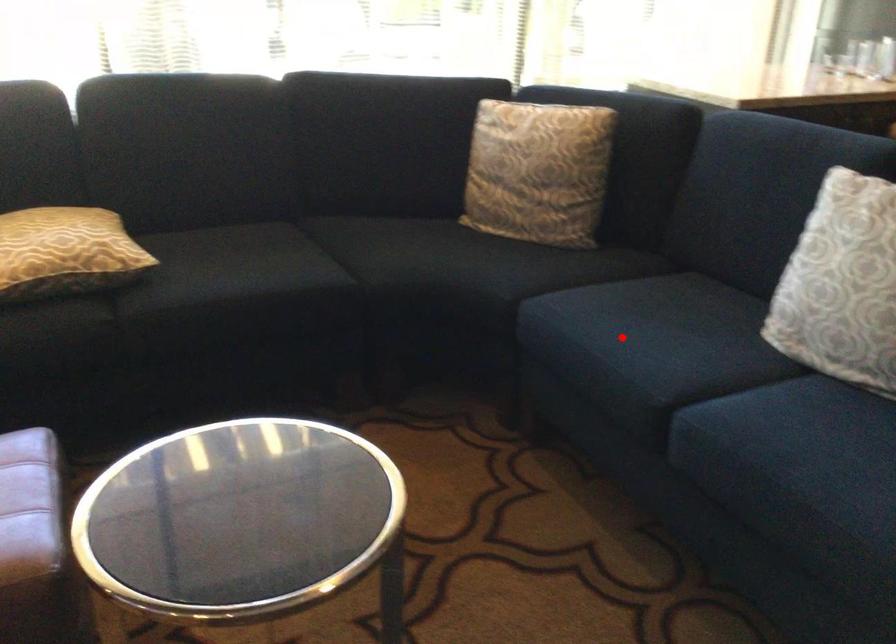
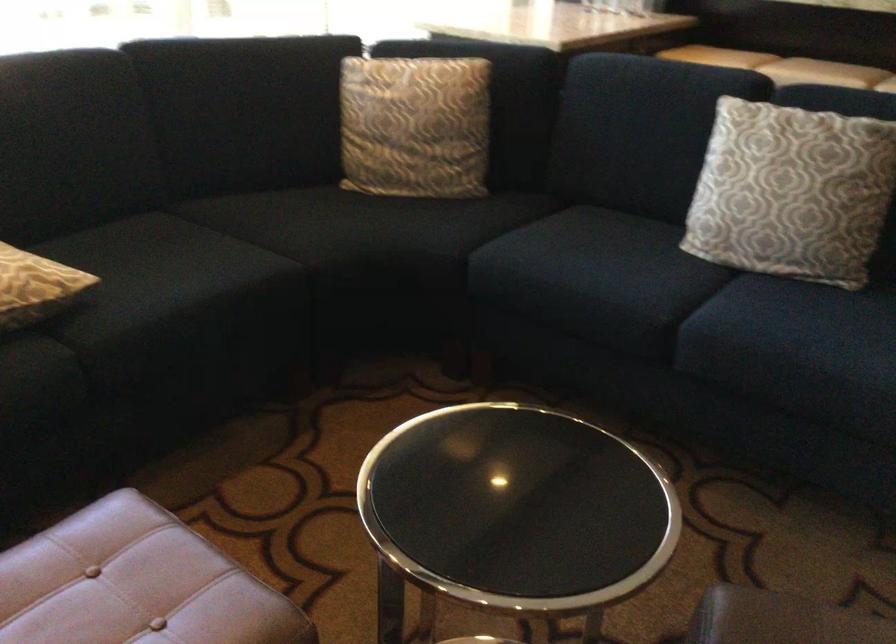
In the second image, find the point that corresponds to the highlighted location in the first image.

(590, 274)